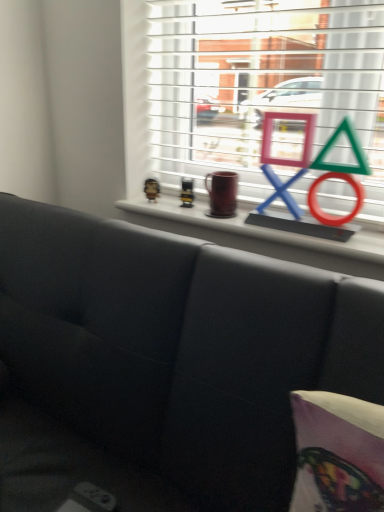
Question: Which is correct: metallic gold figurine at upper center, which is the second toy from right to left, is inside matte black couch at center, or outside of it?

Choices:
 (A) outside
 (B) inside

Answer: (A)

Question: In terms of width, does metallic gold figurine at upper center, which is the second toy from right to left, look wider or thinner when compared to matte black couch at center?

Choices:
 (A) thin
 (B) wide

Answer: (A)

Question: Based on their relative distances, which object is nearer to the metallic silver toy at upper center, the 1th toy positioned from the right?

Choices:
 (A) matte black couch at center
 (B) metallic gold figurine at upper center, the first toy from the left

Answer: (B)

Question: Estimate the real-world distances between objects in this image. Which object is closer to the metallic silver toy at upper center, the 2th toy from the left?

Choices:
 (A) metallic gold figurine at upper center, the first toy from the left
 (B) matte black couch at center

Answer: (A)